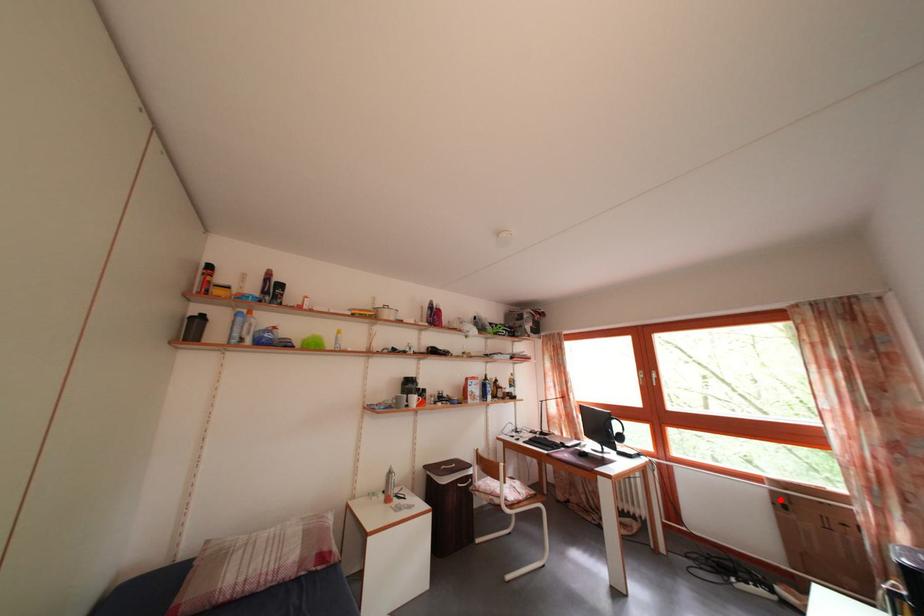
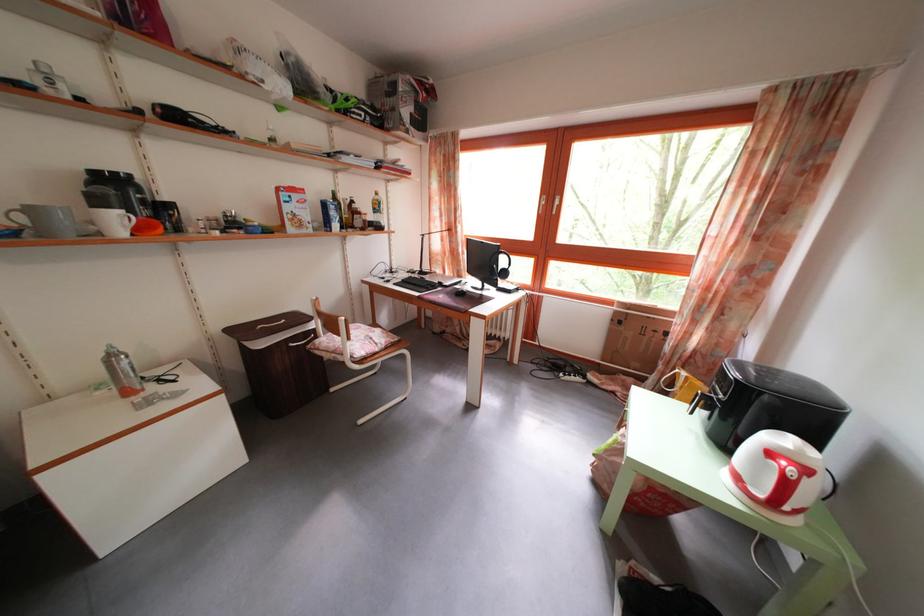
The point at the highlighted location is marked in the first image. Where is the corresponding point in the second image?

(623, 320)